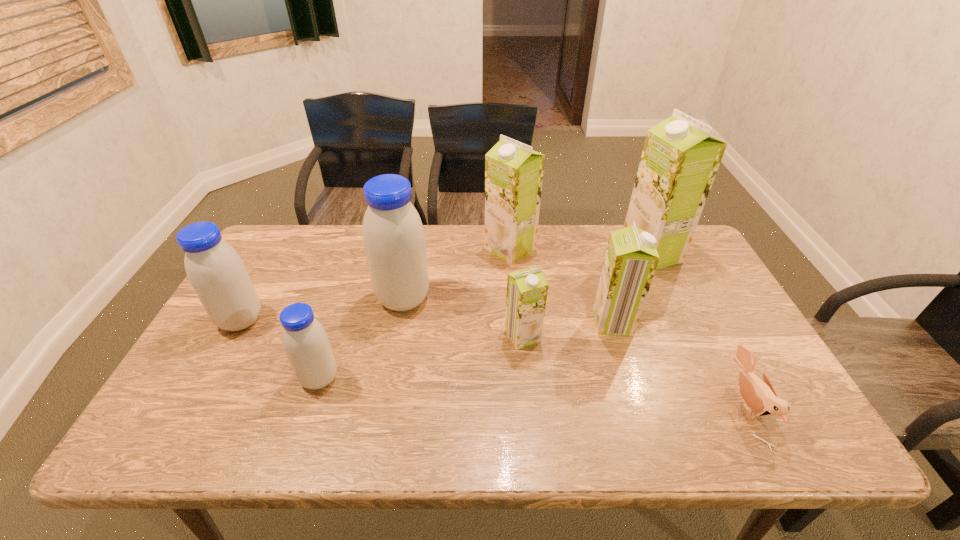
The width and height of the screenshot is (960, 540). Find the location of `blank area at the near edge`. blank area at the near edge is located at coordinates (391, 446).

In the image, there is a desktop. At what (x,y) coordinates should I click in order to perform the action: click on vacant area at the left edge. Please return your answer as a coordinate pair (x, y). Image resolution: width=960 pixels, height=540 pixels. Looking at the image, I should click on (253, 341).

Identify the location of vacant space at the right edge. This screenshot has height=540, width=960. (714, 283).

Locate an element on the screen. blank space at the near right corner of the desktop is located at coordinates (798, 441).

Where is `vacant area between the sixth object from left to right and the second soya milk from left to right`? vacant area between the sixth object from left to right and the second soya milk from left to right is located at coordinates (467, 350).

Find the location of `unoccupied position between the smallest green soya milk and the shortest object`. unoccupied position between the smallest green soya milk and the shortest object is located at coordinates (635, 371).

The width and height of the screenshot is (960, 540). Identify the location of free spot between the rightmost green soya milk and the leftmost object. (445, 287).

You are a GUI agent. You are given a task and a screenshot of the screen. Output one action in this format:
    pyautogui.click(x=<x>, y=<y>)
    Task: Click on the empty space between the second smallest green soya milk and the second biggest green soya milk
    
    Given the screenshot: What is the action you would take?
    pyautogui.click(x=562, y=286)

The image size is (960, 540). Find the location of `object that is the closest to the second green soya milk from right to left`. object that is the closest to the second green soya milk from right to left is located at coordinates (527, 289).

Image resolution: width=960 pixels, height=540 pixels. Identify the location of object that can be found as the closest to the second biggest green soya milk. (393, 235).